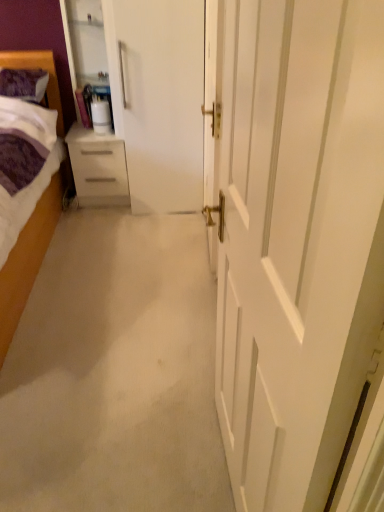
Question: Is white glossy chest of drawers at left positioned in front of purple soft fabric bed at left?

Choices:
 (A) yes
 (B) no

Answer: (B)

Question: From the image's perspective, is white glossy chest of drawers at left on top of purple soft fabric bed at left?

Choices:
 (A) no
 (B) yes

Answer: (B)

Question: Can we say white glossy chest of drawers at left lies outside purple soft fabric bed at left?

Choices:
 (A) yes
 (B) no

Answer: (A)

Question: Is white glossy chest of drawers at left wider than purple soft fabric bed at left?

Choices:
 (A) no
 (B) yes

Answer: (A)

Question: Is there a large distance between white glossy chest of drawers at left and purple soft fabric bed at left?

Choices:
 (A) yes
 (B) no

Answer: (B)

Question: Could you tell me if white glossy chest of drawers at left is turned towards purple soft fabric bed at left?

Choices:
 (A) no
 (B) yes

Answer: (A)

Question: Does purple soft pillow at upper left have a smaller size compared to white glossy chest of drawers at left?

Choices:
 (A) no
 (B) yes

Answer: (B)

Question: Is white glossy chest of drawers at left completely or partially inside purple soft pillow at upper left?

Choices:
 (A) no
 (B) yes

Answer: (A)

Question: Is purple soft pillow at upper left to the right of white glossy chest of drawers at left from the viewer's perspective?

Choices:
 (A) yes
 (B) no

Answer: (B)

Question: Is purple soft pillow at upper left shorter than white glossy chest of drawers at left?

Choices:
 (A) no
 (B) yes

Answer: (B)

Question: Is the depth of purple soft pillow at upper left greater than that of white glossy chest of drawers at left?

Choices:
 (A) no
 (B) yes

Answer: (A)

Question: Does purple soft pillow at upper left come in front of white glossy chest of drawers at left?

Choices:
 (A) no
 (B) yes

Answer: (B)

Question: Is transparent glass cabinet at upper left positioned behind white glossy door at center?

Choices:
 (A) yes
 (B) no

Answer: (A)